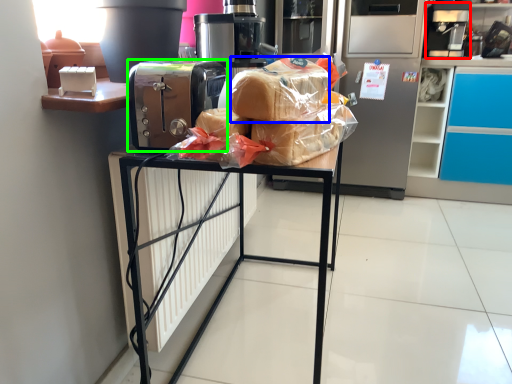
Question: Estimate the real-world distances between objects in this image. Which object is farther from coffee machine (highlighted by a red box), bread (highlighted by a blue box) or home appliance (highlighted by a green box)?

Choices:
 (A) bread
 (B) home appliance

Answer: (B)